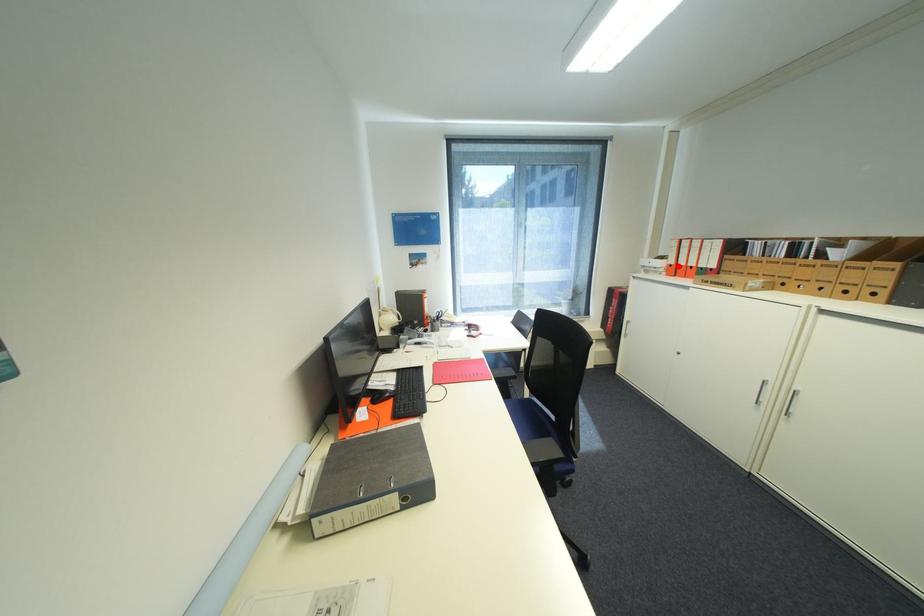
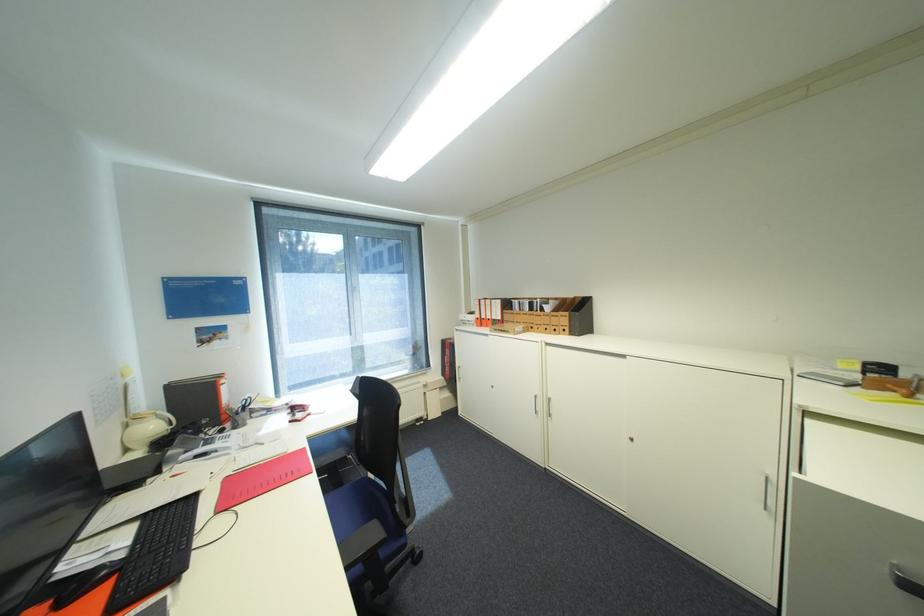
Where in the second image is the point corresponding to the highlighted location from the first image?

(485, 318)